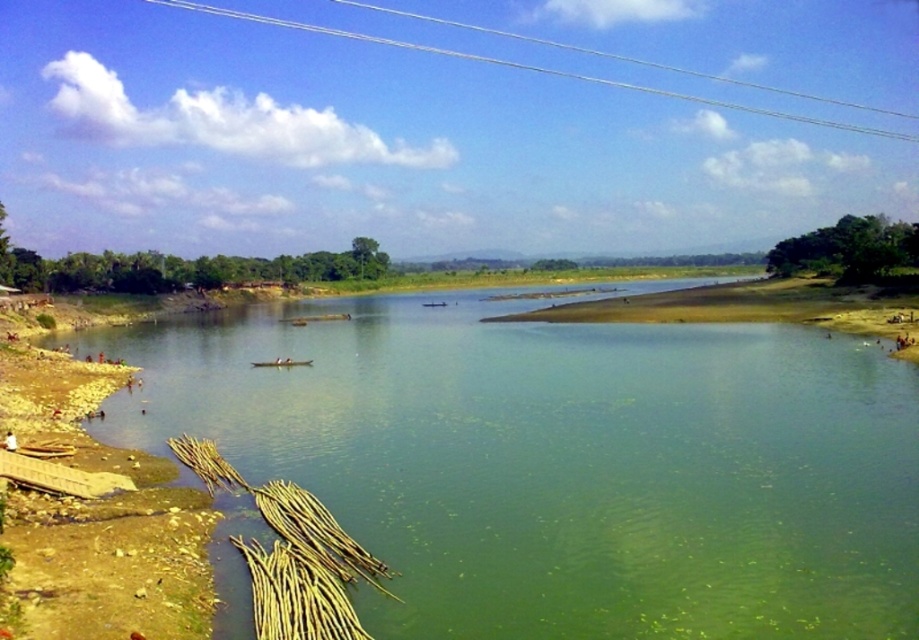
Is green algae-covered water at center thinner than brown rough reed at lower left?

No.

The image size is (919, 640). What do you see at coordinates (562, 461) in the screenshot?
I see `green algae-covered water at center` at bounding box center [562, 461].

Locate an element on the screen. green algae-covered water at center is located at coordinates (562, 461).